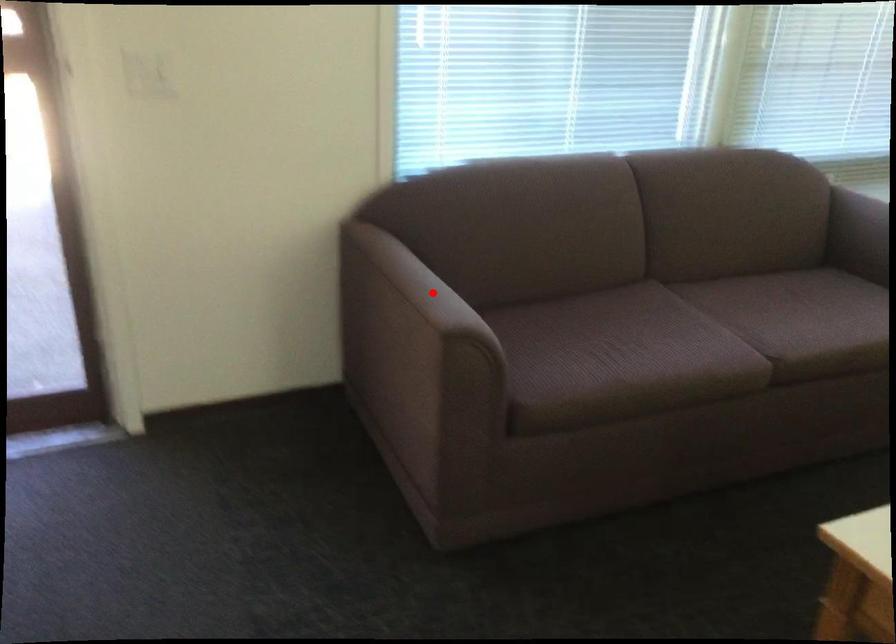
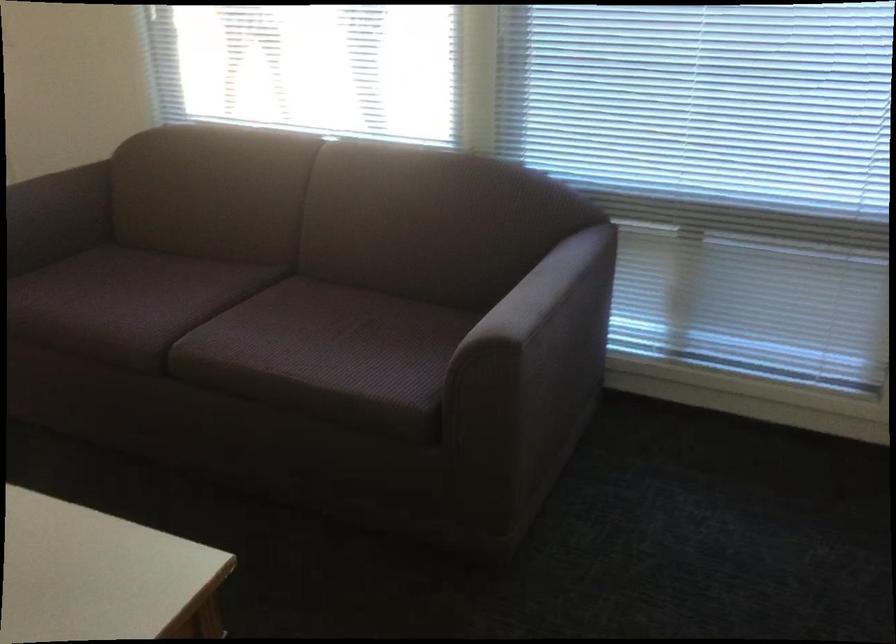
Question: A red point is marked in image1. In image2, is the corresponding 3D point closer to the camera or farther? Reply with the corresponding letter.

Choices:
 (A) The corresponding 3D point is closer.
 (B) The corresponding 3D point is farther.

Answer: (B)